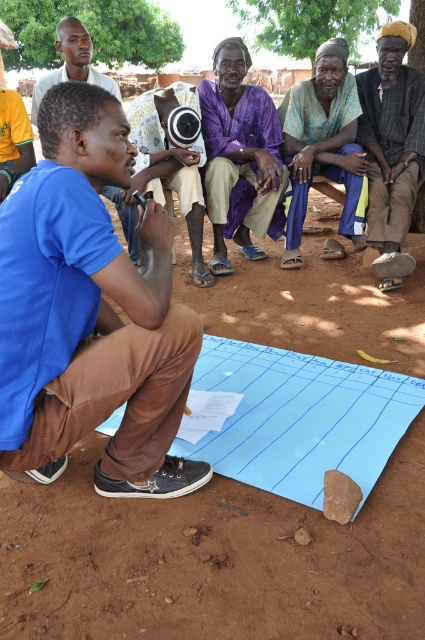
Question: Among these points, which one is nearest to the camera?

Choices:
 (A) (17, 60)
 (B) (119, 97)
 (C) (333, 356)

Answer: (C)

Question: Estimate the real-world distances between objects in this image. Which object is closer to the green leafy tree at upper left?

Choices:
 (A) brown rough rock at lower center
 (B) green leafy tree at upper center
 (C) blue fabric at center
 (D) brown woven cloth at right

Answer: (B)

Question: Can you confirm if brown woven cloth at right is smaller than green leafy tree at upper center?

Choices:
 (A) yes
 (B) no

Answer: (A)

Question: From the image, what is the correct spatial relationship of brown dirt field at lower center in relation to matte black shirt at upper left?

Choices:
 (A) left
 (B) right

Answer: (B)

Question: Can you confirm if brown dirt field at lower center is positioned above printed cotton shirt at center?

Choices:
 (A) no
 (B) yes

Answer: (A)

Question: Based on their relative distances, which object is nearer to the brown woven cloth at right?

Choices:
 (A) purple cotton shirt at center
 (B) matte black camera at center
 (C) printed cotton shirt at center

Answer: (C)